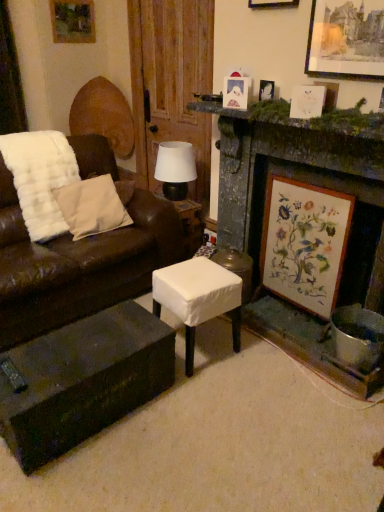
In order to click on empty space that is ontop of dark wood coffee table at lower center (from a real-world perspective) in this screenshot , I will do `click(80, 347)`.